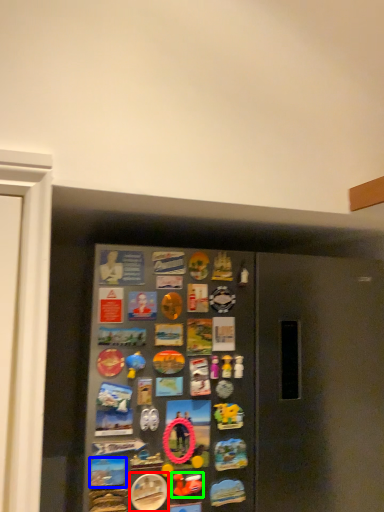
Question: Which is farther away from button (highlighted by a red box)? button (highlighted by a blue box) or art (highlighted by a green box)?

Choices:
 (A) button
 (B) art

Answer: (A)